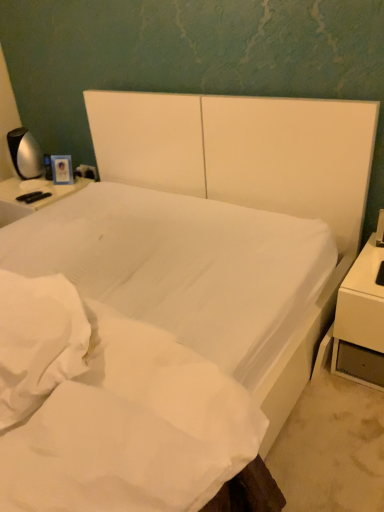
Question: Is the depth of white smooth mattress at center less than that of white glossy nightstand at right?

Choices:
 (A) no
 (B) yes

Answer: (B)

Question: Considering the relative positions of white smooth mattress at center and white glossy nightstand at right in the image provided, is white smooth mattress at center behind white glossy nightstand at right?

Choices:
 (A) yes
 (B) no

Answer: (B)

Question: Can you confirm if white smooth mattress at center is bigger than white glossy nightstand at right?

Choices:
 (A) no
 (B) yes

Answer: (B)

Question: Is white smooth mattress at center not inside white glossy nightstand at right?

Choices:
 (A) yes
 (B) no

Answer: (A)

Question: From a real-world perspective, is white smooth mattress at center under white glossy nightstand at right?

Choices:
 (A) yes
 (B) no

Answer: (B)

Question: Considering the positions of white smooth mattress at center and satin silver lamp at left in the image, is white smooth mattress at center taller or shorter than satin silver lamp at left?

Choices:
 (A) short
 (B) tall

Answer: (B)

Question: From a real-world perspective, is white smooth mattress at center above or below satin silver lamp at left?

Choices:
 (A) above
 (B) below

Answer: (B)

Question: From the image's perspective, is white smooth mattress at center positioned above or below satin silver lamp at left?

Choices:
 (A) above
 (B) below

Answer: (B)

Question: Is point (0, 302) closer or farther from the camera than point (13, 154)?

Choices:
 (A) farther
 (B) closer

Answer: (B)

Question: Considering the positions of white glossy nightstand at right and satin silver lamp at left in the image, is white glossy nightstand at right bigger or smaller than satin silver lamp at left?

Choices:
 (A) small
 (B) big

Answer: (B)

Question: Is point (365, 300) closer or farther from the camera than point (16, 164)?

Choices:
 (A) farther
 (B) closer

Answer: (B)

Question: From the image's perspective, is white glossy nightstand at right located above or below satin silver lamp at left?

Choices:
 (A) below
 (B) above

Answer: (A)

Question: Considering their positions, is white glossy nightstand at right located in front of or behind satin silver lamp at left?

Choices:
 (A) behind
 (B) front

Answer: (B)

Question: From a real-world perspective, is white smooth mattress at center positioned above or below white glossy nightstand at right?

Choices:
 (A) below
 (B) above

Answer: (B)

Question: Do you think white smooth mattress at center is within white glossy nightstand at right, or outside of it?

Choices:
 (A) inside
 (B) outside

Answer: (B)